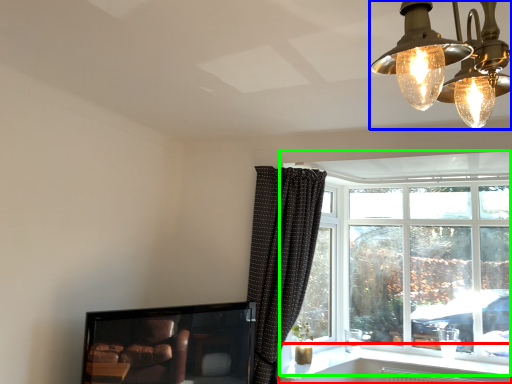
Question: Which object is positioned farthest from window sill (highlighted by a red box)? Select from lamp (highlighted by a blue box) and window (highlighted by a green box).

Choices:
 (A) lamp
 (B) window

Answer: (A)